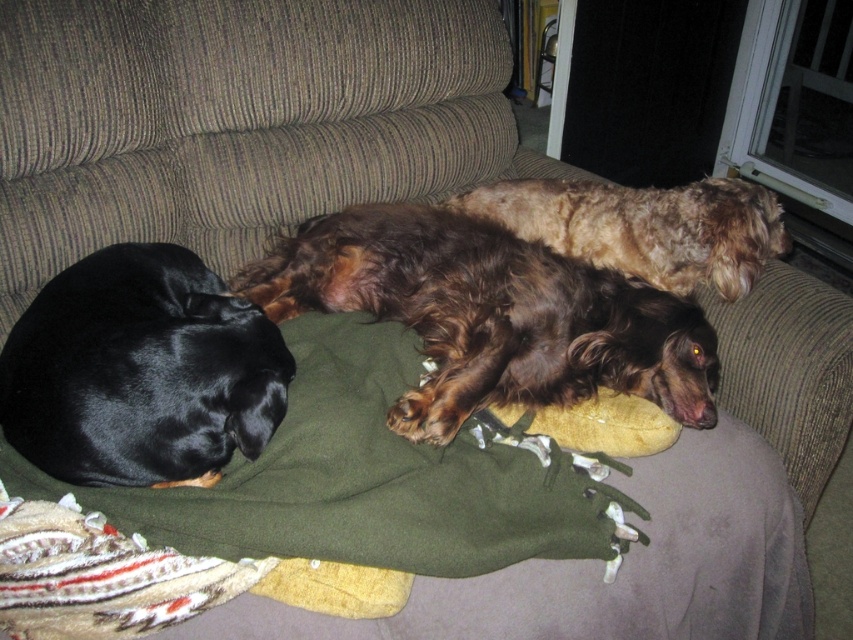
Question: Which point is farther to the camera?

Choices:
 (A) (62, 451)
 (B) (518, 221)

Answer: (B)

Question: Which of the following is the closest to the observer?

Choices:
 (A) (543, 403)
 (B) (631, 196)

Answer: (A)

Question: Is brown shaggy dog at center smaller than fuzzy brown dog at center?

Choices:
 (A) yes
 (B) no

Answer: (B)

Question: Which object appears closest to the camera in this image?

Choices:
 (A) black glossy dog at left
 (B) fuzzy brown dog at center

Answer: (A)

Question: Is brown shaggy dog at center positioned in front of fuzzy brown dog at center?

Choices:
 (A) no
 (B) yes

Answer: (B)

Question: Does brown shaggy dog at center have a larger size compared to black glossy dog at left?

Choices:
 (A) yes
 (B) no

Answer: (A)